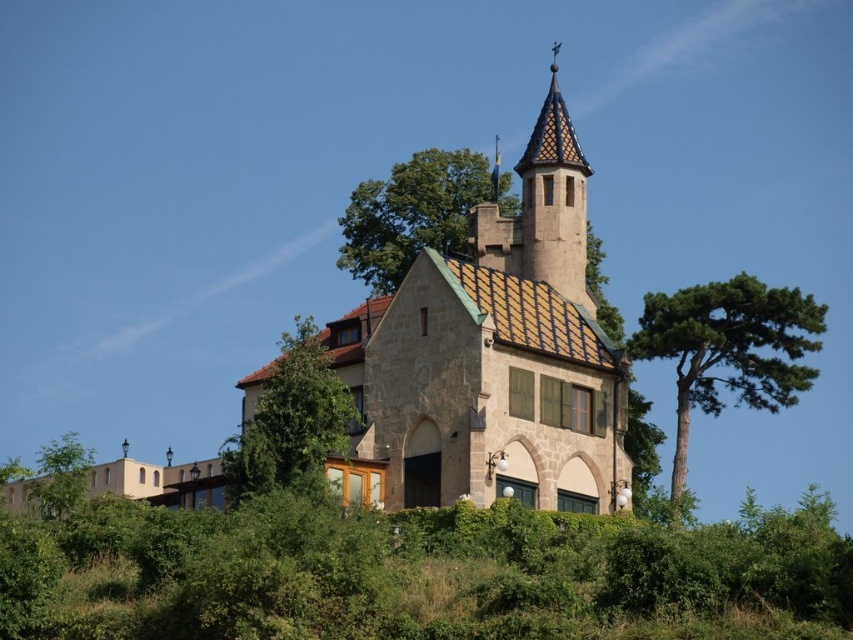
Question: Considering the real-world distances, which object is closest to the brown stone church at center?

Choices:
 (A) glazed ceramic spire at upper center
 (B) green leafy tree at center
 (C) green leafy tree at upper center

Answer: (A)

Question: Observing the image, what is the correct spatial positioning of green textured tree at right in reference to green leafy tree at upper center?

Choices:
 (A) right
 (B) left

Answer: (A)

Question: Among these points, which one is nearest to the camera?

Choices:
 (A) click(x=364, y=205)
 (B) click(x=62, y=442)
 (C) click(x=543, y=186)

Answer: (C)

Question: Is brown stone church at center wider than green leafy tree at lower left?

Choices:
 (A) no
 (B) yes

Answer: (B)

Question: Is the position of green leafy tree at upper center more distant than that of glazed ceramic spire at upper center?

Choices:
 (A) yes
 (B) no

Answer: (B)

Question: Which of the following is the closest to the observer?

Choices:
 (A) glazed ceramic spire at upper center
 (B) green leafy tree at upper center
 (C) brown stone church at center
 (D) green leafy tree at lower left

Answer: (C)